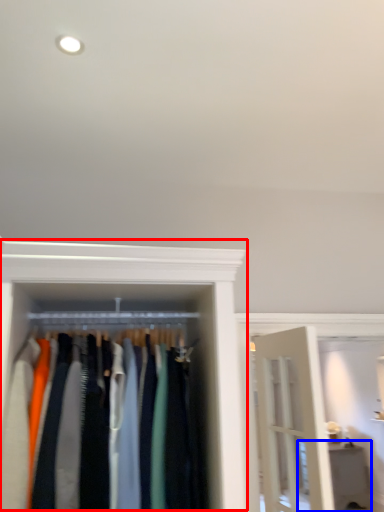
Question: Which object appears closest to the camera in this image, closet (highlighted by a red box) or furniture (highlighted by a blue box)?

Choices:
 (A) closet
 (B) furniture

Answer: (A)